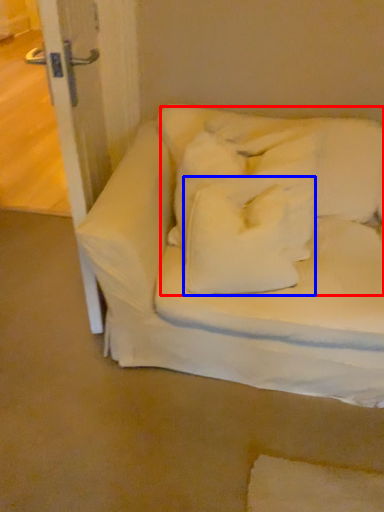
Question: Which object is further to the camera taking this photo, bedding (highlighted by a red box) or pillow (highlighted by a blue box)?

Choices:
 (A) bedding
 (B) pillow

Answer: (A)